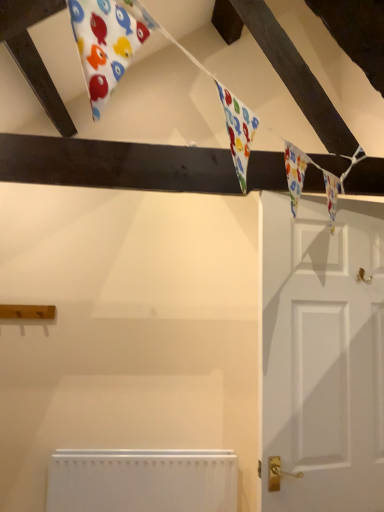
Question: From the image's perspective, is white matte door at right located above or below white matte radiator at lower center?

Choices:
 (A) above
 (B) below

Answer: (A)

Question: Is white matte door at right taller or shorter than white matte radiator at lower center?

Choices:
 (A) tall
 (B) short

Answer: (A)

Question: Relative to white matte radiator at lower center, is white matte door at right in front or behind?

Choices:
 (A) behind
 (B) front

Answer: (B)

Question: Is point [61, 463] positioned closer to the camera than point [283, 435]?

Choices:
 (A) closer
 (B) farther

Answer: (B)

Question: Looking at their shapes, would you say white matte radiator at lower center is wider or thinner than white matte door at right?

Choices:
 (A) wide
 (B) thin

Answer: (A)

Question: From the image's perspective, relative to white matte door at right, is white matte radiator at lower center above or below?

Choices:
 (A) below
 (B) above

Answer: (A)

Question: Relative to white matte door at right, is white matte radiator at lower center in front or behind?

Choices:
 (A) front
 (B) behind

Answer: (B)